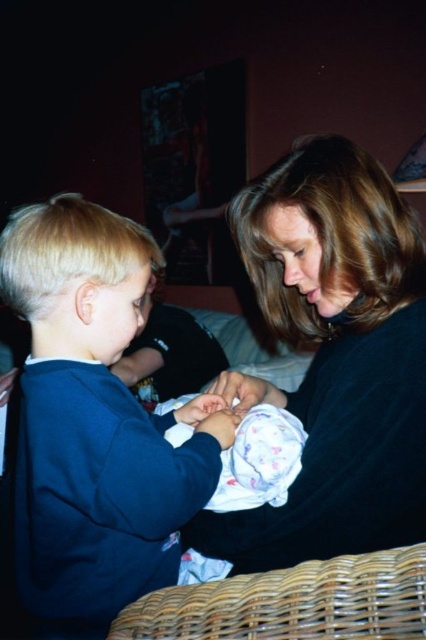
How far apart are dark blue sweatshirt at left and woven brown basket at lower center?

dark blue sweatshirt at left is 10.48 inches away from woven brown basket at lower center.

Which is in front, point (22, 524) or point (255, 608)?

Point (255, 608) is in front.

You are a GUI agent. You are given a task and a screenshot of the screen. Output one action in this format:
    pyautogui.click(x=<x>, y=<y>)
    Task: Click on the dark blue sweatshirt at left
    The image size is (426, 640).
    Given the screenshot: What is the action you would take?
    click(x=94, y=420)

Can you confirm if dark blue sweatshirt at left is bigger than fluffy white blanket at center?

Yes.

Does dark blue sweatshirt at left have a greater height compared to fluffy white blanket at center?

Correct, dark blue sweatshirt at left is much taller as fluffy white blanket at center.

I want to click on dark blue sweatshirt at left, so click(x=94, y=420).

Which is behind, point (386, 524) or point (311, 577)?

The point (386, 524) is behind.

Can you confirm if black matte sweater at center is taller than woven brown basket at lower center?

Correct, black matte sweater at center is much taller as woven brown basket at lower center.

At what (x,y) coordinates should I click in order to perform the action: click on black matte sweater at center. Please return your answer as a coordinate pair (x, y). Looking at the image, I should click on (333, 356).